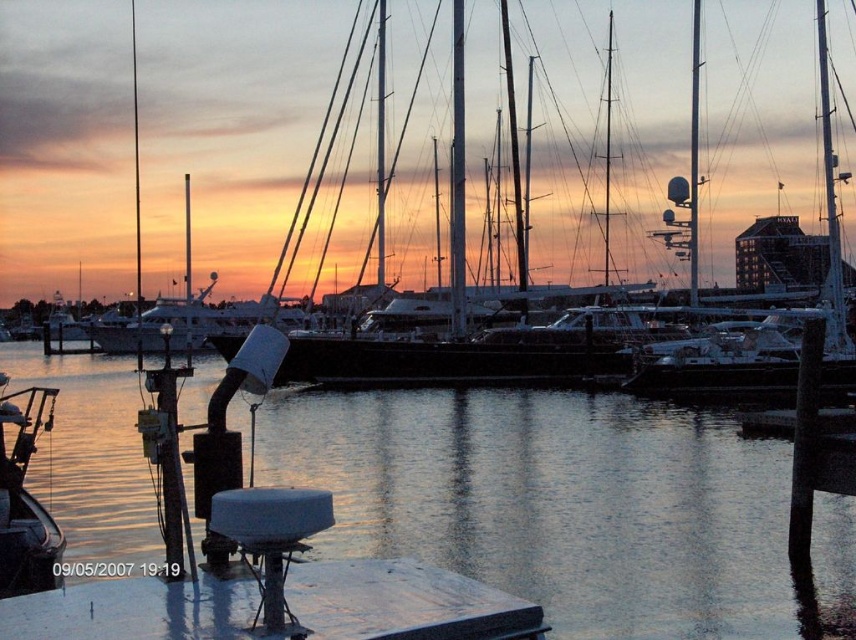
You are a photographer planning to capture the metallic gray boat at lower left and the white glossy mast at center in your shot. Which object should you focus on first if you want to ensure both are in frame without moving the camera? Explain your reasoning based on their sizes.

The metallic gray boat at lower left is wider than the white glossy mast at center. Therefore, focusing on the metallic gray boat at lower left first would ensure there is enough space in the frame to include the narrower white glossy mast at center without needing to adjust the camera position.

You are a photographer planning to capture the metallic gray boat at lower left and the white glossy mast at center in a single frame. Considering their sizes in the image, which object will appear smaller?

The metallic gray boat at lower left occupies less space than the white glossy mast at center, so it will appear smaller in the photograph.

You are standing on the dock and want to board the shiny silver yacht at center. The dock is 150 feet long. Is the yacht within the dock length?

The shiny silver yacht at center is 190.80 feet away from the viewer. Since the dock is only 150 feet long, the yacht is beyond the dock length, so you cannot reach it by walking along the dock.